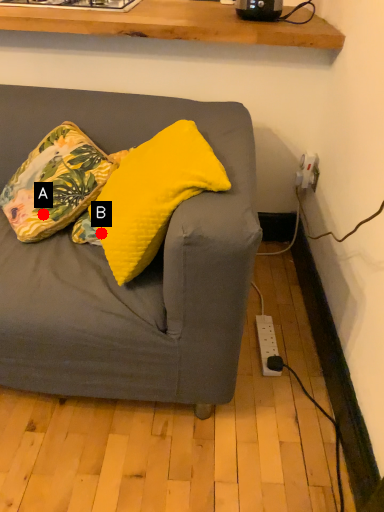
Question: Two points are circled on the image, labeled by A and B beside each circle. Which of the following is the closest to the observer?

Choices:
 (A) A is closer
 (B) B is closer

Answer: (B)